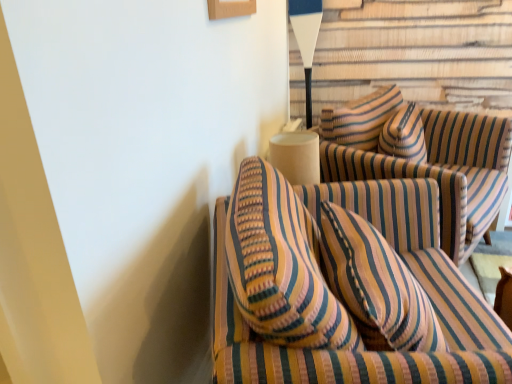
Measure the distance between point (x=300, y=48) and camera.

Point (x=300, y=48) is 2.49 meters away from camera.

You are a GUI agent. You are given a task and a screenshot of the screen. Output one action in this format:
    pyautogui.click(x=<x>, y=<y>)
    Task: Click on the white matte table lamp at upper center
    
    Given the screenshot: What is the action you would take?
    (306, 40)

Find the location of a particular element. The height and width of the screenshot is (384, 512). white matte table lamp at upper center is located at coordinates (306, 40).

Considering the sizes of objects striped fabric couch at center, the first studio couch viewed from the back, and striped fabric couch at center, placed as the 2th studio couch when sorted from back to front, in the image provided, who is bigger, striped fabric couch at center, the first studio couch viewed from the back, or striped fabric couch at center, placed as the 2th studio couch when sorted from back to front,?

With larger size is striped fabric couch at center, placed as the 2th studio couch when sorted from back to front.

Between point (413, 117) and point (322, 342), which one is positioned in front?

The point (322, 342) is closer to the camera.

Is striped fabric couch at center, the first studio couch viewed from the back, further to the viewer compared to striped fabric couch at center, which is the 1th studio couch in front-to-back order?

Yes, it is behind striped fabric couch at center, which is the 1th studio couch in front-to-back order.

Is striped fabric couch at center, the second studio couch viewed from the front, shorter than striped fabric couch at center, placed as the 2th studio couch when sorted from back to front?

Yes, striped fabric couch at center, the second studio couch viewed from the front, is shorter than striped fabric couch at center, placed as the 2th studio couch when sorted from back to front.

Is striped fabric couch at center, placed as the 2th studio couch when sorted from back to front, facing towards striped fabric couch at center, the first studio couch viewed from the back?

Answer: No, striped fabric couch at center, placed as the 2th studio couch when sorted from back to front, is not turned towards striped fabric couch at center, the first studio couch viewed from the back.

Which object is positioned more to the right, striped fabric couch at center, placed as the 2th studio couch when sorted from back to front, or striped fabric couch at center, the first studio couch viewed from the back?

From the viewer's perspective, striped fabric couch at center, the first studio couch viewed from the back, appears more on the right side.

Considering the sizes of objects striped fabric couch at center, which is the 1th studio couch in front-to-back order, and striped fabric couch at center, the first studio couch viewed from the back, in the image provided, who is bigger, striped fabric couch at center, which is the 1th studio couch in front-to-back order, or striped fabric couch at center, the first studio couch viewed from the back,?

Bigger between the two is striped fabric couch at center, which is the 1th studio couch in front-to-back order.

Is striped fabric couch at center, which is the 1th studio couch in front-to-back order, closer to the viewer compared to striped fabric couch at center, the first studio couch viewed from the back?

Yes.

Is white matte table lamp at upper center looking in the opposite direction of striped fabric couch at center, the second studio couch viewed from the front?

No, striped fabric couch at center, the second studio couch viewed from the front, is not at the back of white matte table lamp at upper center.

Can you confirm if white matte table lamp at upper center is wider than striped fabric couch at center, the second studio couch viewed from the front?

No.

Would you consider white matte table lamp at upper center to be distant from striped fabric couch at center, the first studio couch viewed from the back?

Actually, white matte table lamp at upper center and striped fabric couch at center, the first studio couch viewed from the back, are a little close together.

Based on the photo, can you confirm if white matte table lamp at upper center is positioned to the right of striped fabric couch at center, the first studio couch viewed from the back?

A: In fact, white matte table lamp at upper center is to the left of striped fabric couch at center, the first studio couch viewed from the back.

In terms of height, does white matte table lamp at upper center look taller or shorter compared to striped fabric couch at center, placed as the 2th studio couch when sorted from back to front?

white matte table lamp at upper center is shorter than striped fabric couch at center, placed as the 2th studio couch when sorted from back to front.

Which object is further away from the camera taking this photo, white matte table lamp at upper center or striped fabric couch at center, placed as the 2th studio couch when sorted from back to front?

white matte table lamp at upper center is more distant.

From the image's perspective, relative to striped fabric couch at center, which is the 1th studio couch in front-to-back order, is white matte table lamp at upper center above or below?

Based on their image positions, white matte table lamp at upper center is located above striped fabric couch at center, which is the 1th studio couch in front-to-back order.

Considering the sizes of white matte table lamp at upper center and striped fabric couch at center, which is the 1th studio couch in front-to-back order, in the image, is white matte table lamp at upper center bigger or smaller than striped fabric couch at center, which is the 1th studio couch in front-to-back order,?

Considering their sizes, white matte table lamp at upper center takes up less space than striped fabric couch at center, which is the 1th studio couch in front-to-back order.

Can you see striped fabric couch at center, which is the 1th studio couch in front-to-back order, touching white matte table lamp at upper center?

striped fabric couch at center, which is the 1th studio couch in front-to-back order, and white matte table lamp at upper center are not in contact.

Is striped fabric couch at center, which is the 1th studio couch in front-to-back order, oriented away from white matte table lamp at upper center?

No.

Is the position of striped fabric couch at center, placed as the 2th studio couch when sorted from back to front, more distant than that of white matte table lamp at upper center?

No, it is in front of white matte table lamp at upper center.

Does striped fabric couch at center, the second studio couch viewed from the front, lie behind white matte table lamp at upper center?

No, it is in front of white matte table lamp at upper center.

Is striped fabric couch at center, the first studio couch viewed from the back, inside the boundaries of white matte table lamp at upper center, or outside?

striped fabric couch at center, the first studio couch viewed from the back, is outside white matte table lamp at upper center.

Who is bigger, striped fabric couch at center, the second studio couch viewed from the front, or white matte table lamp at upper center?

striped fabric couch at center, the second studio couch viewed from the front.

Identify the location of studio couch in front of the striped fabric couch at center, the first studio couch viewed from the back. (344, 288).

At what (x,y) coordinates should I click in order to perform the action: click on studio couch below the striped fabric couch at center, the first studio couch viewed from the back (from the image's perspective). Please return your answer as a coordinate pair (x, y). Looking at the image, I should click on (344, 288).

From the image, which object appears to be nearer to striped fabric couch at center, the second studio couch viewed from the front, striped fabric couch at center, placed as the 2th studio couch when sorted from back to front, or white matte table lamp at upper center?

The object closer to striped fabric couch at center, the second studio couch viewed from the front, is striped fabric couch at center, placed as the 2th studio couch when sorted from back to front.

From the image, which object appears to be nearer to striped fabric couch at center, which is the 1th studio couch in front-to-back order, striped fabric couch at center, the first studio couch viewed from the back, or white matte table lamp at upper center?

striped fabric couch at center, the first studio couch viewed from the back, lies closer to striped fabric couch at center, which is the 1th studio couch in front-to-back order, than the other object.

Based on the photo, estimate the real-world distances between objects in this image. Which object is closer to striped fabric couch at center, the second studio couch viewed from the front, white matte table lamp at upper center or striped fabric couch at center, placed as the 2th studio couch when sorted from back to front?

striped fabric couch at center, placed as the 2th studio couch when sorted from back to front, lies closer to striped fabric couch at center, the second studio couch viewed from the front, than the other object.

Based on their spatial positions, is white matte table lamp at upper center or striped fabric couch at center, the second studio couch viewed from the front, closer to striped fabric couch at center, placed as the 2th studio couch when sorted from back to front?

striped fabric couch at center, the second studio couch viewed from the front, is positioned closer to the anchor striped fabric couch at center, placed as the 2th studio couch when sorted from back to front.

Based on the photo, from the image, which object appears to be farther from white matte table lamp at upper center, striped fabric couch at center, the first studio couch viewed from the back, or striped fabric couch at center, which is the 1th studio couch in front-to-back order?

Based on the image, striped fabric couch at center, which is the 1th studio couch in front-to-back order, appears to be further to white matte table lamp at upper center.

When comparing their distances from white matte table lamp at upper center, does striped fabric couch at center, placed as the 2th studio couch when sorted from back to front, or striped fabric couch at center, the second studio couch viewed from the front, seem further?

Based on the image, striped fabric couch at center, placed as the 2th studio couch when sorted from back to front, appears to be further to white matte table lamp at upper center.

Image resolution: width=512 pixels, height=384 pixels. In order to click on studio couch between striped fabric couch at center, which is the 1th studio couch in front-to-back order, and white matte table lamp at upper center, along the z-axis in this screenshot , I will do `click(423, 158)`.